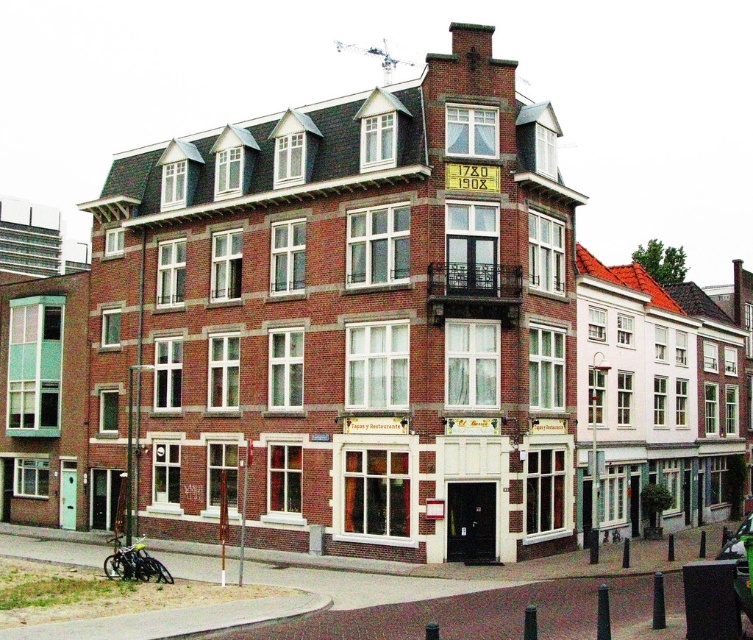
Question: Is brick building at center positioned at the back of metallic silver motorcycle at lower left?

Choices:
 (A) yes
 (B) no

Answer: (A)

Question: Which object is closer to the camera taking this photo?

Choices:
 (A) brick building at center
 (B) metallic silver motorcycle at lower left
 (C) metallic silver car at center

Answer: (C)

Question: Where is metallic silver motorcycle at lower left located in relation to metallic silver car at center in the image?

Choices:
 (A) right
 (B) left

Answer: (B)

Question: Among these points, which one is nearest to the camera?

Choices:
 (A) (742, 548)
 (B) (226, 412)

Answer: (A)

Question: Is metallic silver motorcycle at lower left wider than metallic silver car at center?

Choices:
 (A) no
 (B) yes

Answer: (A)

Question: Which object appears farthest from the camera in this image?

Choices:
 (A) brick building at center
 (B) metallic silver motorcycle at lower left
 (C) metallic silver car at center

Answer: (A)